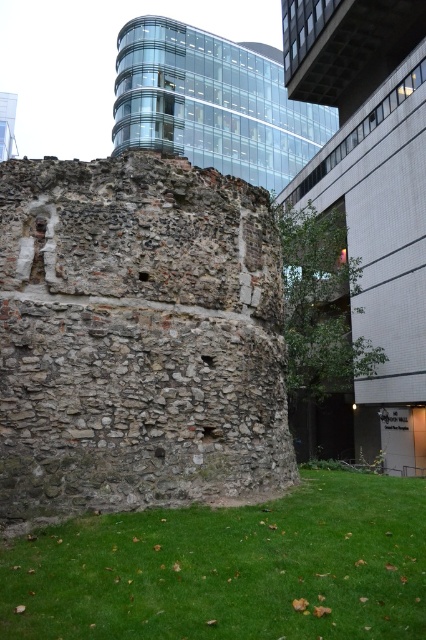
Where is `rustic stone ruins at center`? This screenshot has width=426, height=640. rustic stone ruins at center is located at coordinates (137, 337).

Is rustic stone ruins at center bigger than green grass at lower center?

Yes.

What do you see at coordinates (137, 337) in the screenshot? The image size is (426, 640). I see `rustic stone ruins at center` at bounding box center [137, 337].

Locate an element on the screen. This screenshot has height=640, width=426. rustic stone ruins at center is located at coordinates (137, 337).

Which is above, green grass at lower center or stone wall at center?

stone wall at center

Does green grass at lower center appear under stone wall at center?

Indeed, green grass at lower center is positioned under stone wall at center.

This screenshot has height=640, width=426. What do you see at coordinates (230, 568) in the screenshot? I see `green grass at lower center` at bounding box center [230, 568].

At what (x,y) coordinates should I click in order to perform the action: click on green grass at lower center. Please return your answer as a coordinate pair (x, y). Looking at the image, I should click on click(230, 568).

Is rustic stone ruins at center closer to camera compared to stone wall at center?

That is True.

Is point (103, 422) positioned in front of point (299, 13)?

Yes, point (103, 422) is closer to viewer.

Where is `rustic stone ruins at center`? This screenshot has height=640, width=426. rustic stone ruins at center is located at coordinates (137, 337).

You are a GUI agent. You are given a task and a screenshot of the screen. Output one action in this format:
    pyautogui.click(x=<x>, y=<y>)
    Task: Click on the rustic stone ruins at center
    Image resolution: width=426 pixels, height=640 pixels.
    Given the screenshot: What is the action you would take?
    pyautogui.click(x=137, y=337)